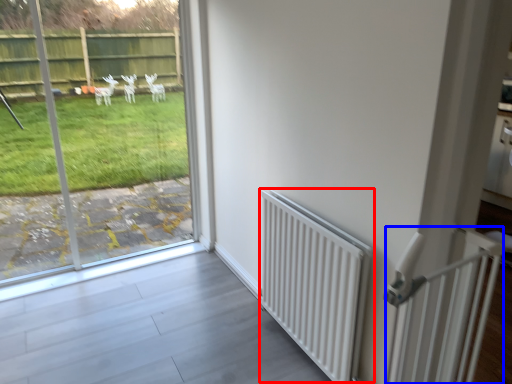
Question: Among these objects, which one is nearest to the camera, radiator (highlighted by a red box) or balustrade (highlighted by a blue box)?

Choices:
 (A) radiator
 (B) balustrade

Answer: (B)